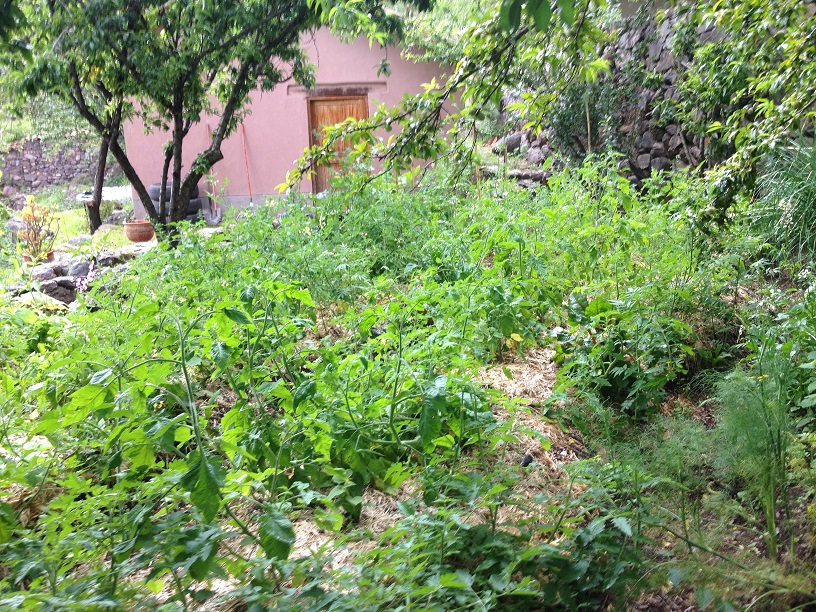
At what (x,y) coordinates should I click in order to perform the action: click on planter with plant inside it. Please return your answer as a coordinate pair (x, y). This screenshot has width=816, height=612. Looking at the image, I should click on (33, 255).